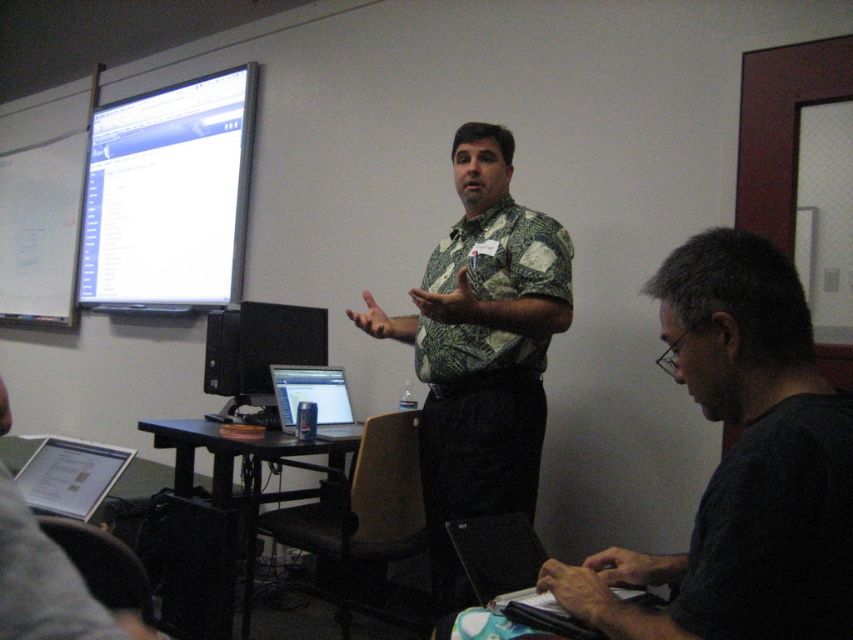
Question: Does dark gray shirt at lower right have a smaller size compared to white glossy projection screen at upper left?

Choices:
 (A) yes
 (B) no

Answer: (A)

Question: Does green patterned shirt at center have a lesser width compared to white glossy projection screen at upper left?

Choices:
 (A) no
 (B) yes

Answer: (B)

Question: Which is farther from the white glossy projection screen at upper left?

Choices:
 (A) matte black laptop at center
 (B) black matte laptop at lower right

Answer: (B)

Question: Considering the real-world distances, which object is farthest from the white glossy projection screen at upper left?

Choices:
 (A) matte black laptop at center
 (B) black matte laptop at lower right

Answer: (B)

Question: Which is farther from the black matte laptop at lower right?

Choices:
 (A) matte black laptop at center
 (B) matte black monitor at center
 (C) white glossy projection screen at upper left

Answer: (C)

Question: Can you confirm if dark gray shirt at lower right is positioned below matte black monitor at center?

Choices:
 (A) no
 (B) yes

Answer: (B)